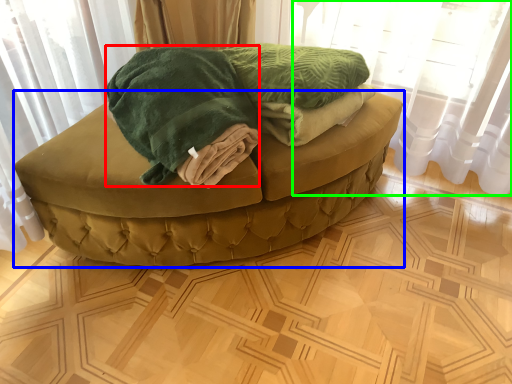
Question: Based on their relative distances, which object is nearer to cloth (highlighted by a red box)? Choose from furniture (highlighted by a blue box) and curtain (highlighted by a green box).

Choices:
 (A) furniture
 (B) curtain

Answer: (A)